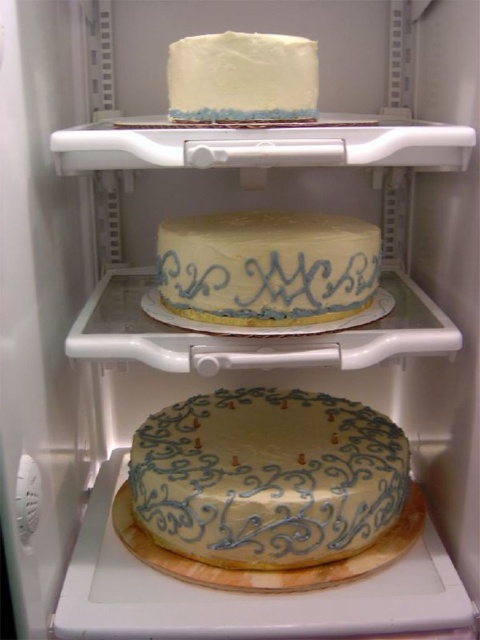
You are standing in front of the refrigerator and see the white buttercream cake at center marked by point [266,268]. What is the exact location of this cake?

The white buttercream cake at center is marked by the point [266,268].

You are standing in front of the refrigerator and want to reach the point at the bottom shelf. Which point should you move towards, point at position (300, 417) or point at position (279, 118)?

You should move towards point at position (279, 118) because point at position (300, 417) is behind it.